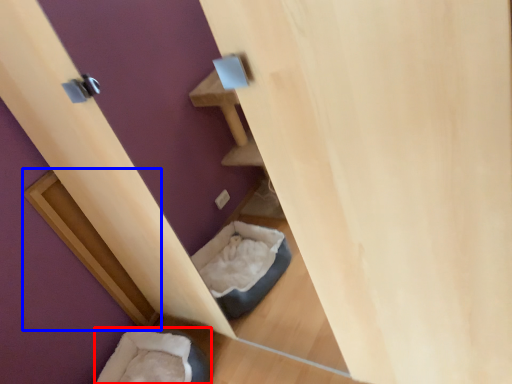
Question: Which object is closer to the camera taking this photo, bean bag chair (highlighted by a red box) or wood (highlighted by a blue box)?

Choices:
 (A) bean bag chair
 (B) wood

Answer: (A)